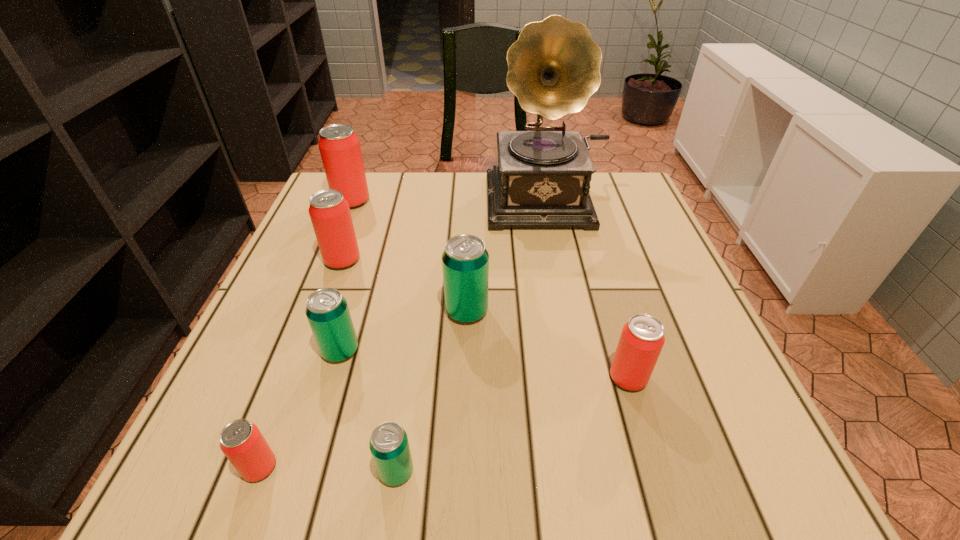
Locate an element on the screen. golden record player is located at coordinates (542, 180).

What are the coordinates of `the tallest object` in the screenshot? It's located at (542, 180).

The height and width of the screenshot is (540, 960). In order to click on the farthest beer can in this screenshot , I will do `click(339, 146)`.

At what (x,y) coordinates should I click in order to perform the action: click on the farthest red beer can. Please return your answer as a coordinate pair (x, y). Looking at the image, I should click on (339, 146).

Where is `the sixth nearest object`? Image resolution: width=960 pixels, height=540 pixels. the sixth nearest object is located at coordinates click(330, 215).

In order to click on the third smallest red beer can in this screenshot , I will do `click(330, 215)`.

The height and width of the screenshot is (540, 960). I want to click on the biggest teal beer can, so click(465, 261).

The height and width of the screenshot is (540, 960). In order to click on the fifth nearest object in this screenshot , I will do `click(465, 261)`.

Locate an element on the screen. The image size is (960, 540). the second nearest red beer can is located at coordinates (642, 338).

The width and height of the screenshot is (960, 540). I want to click on the rightmost red beer can, so click(642, 338).